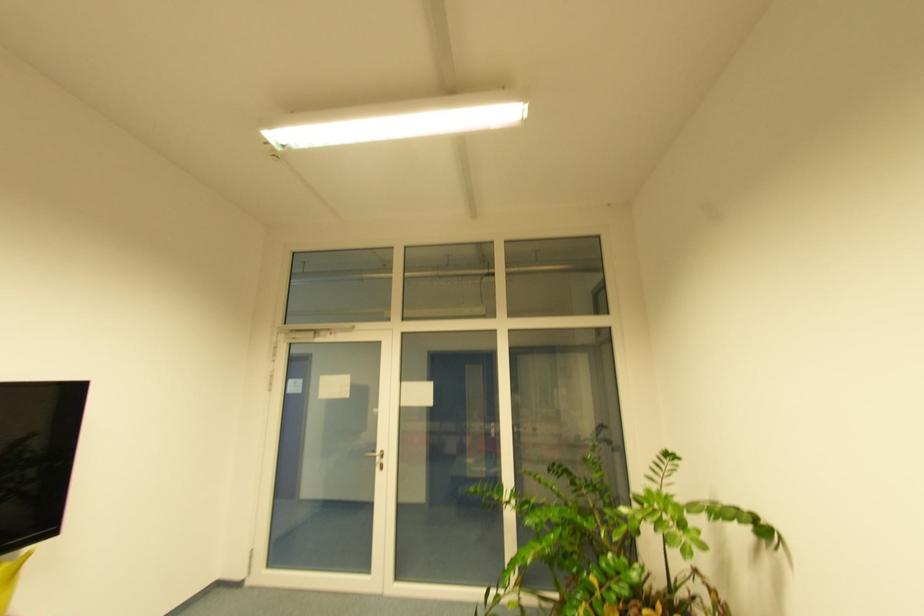
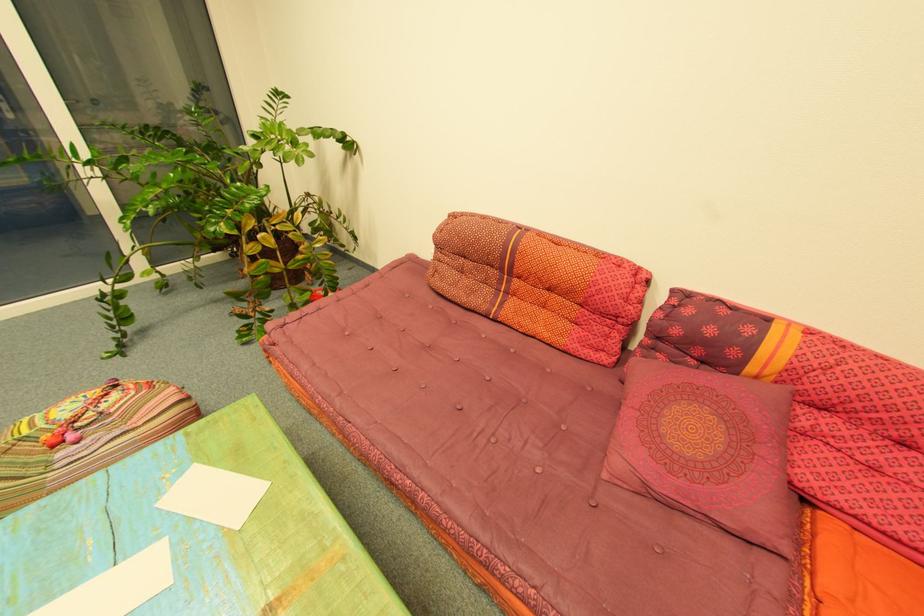
How did the camera likely rotate?

The camera rotated toward right-down.